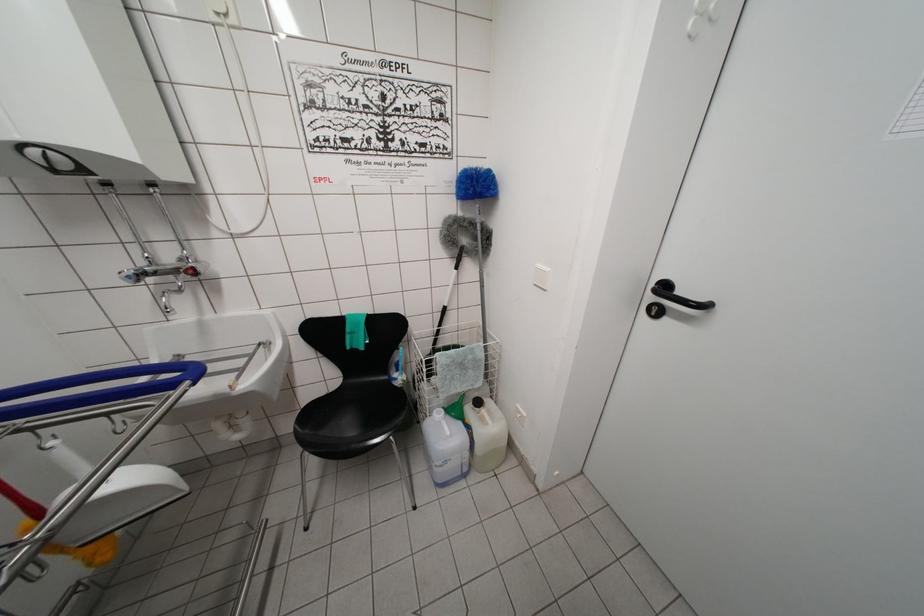
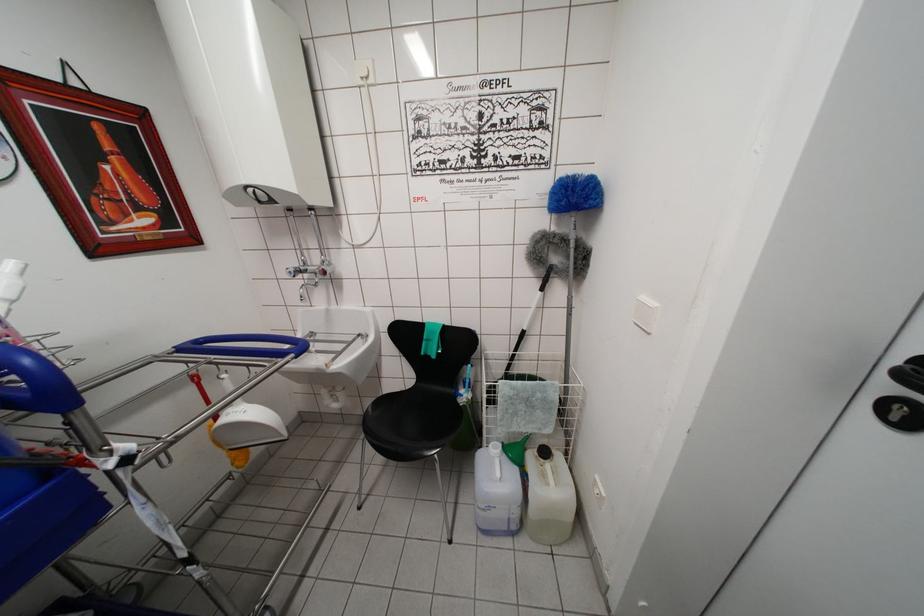
In the second image, find the point that corresponds to pixel 479 243 in the first image.

(572, 261)